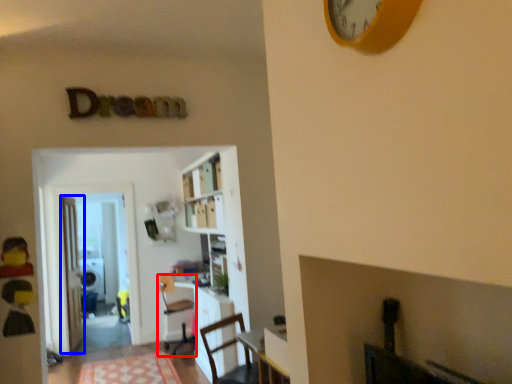
Question: Which object is closer to the camera taking this photo, chair (highlighted by a red box) or door (highlighted by a blue box)?

Choices:
 (A) chair
 (B) door

Answer: (A)